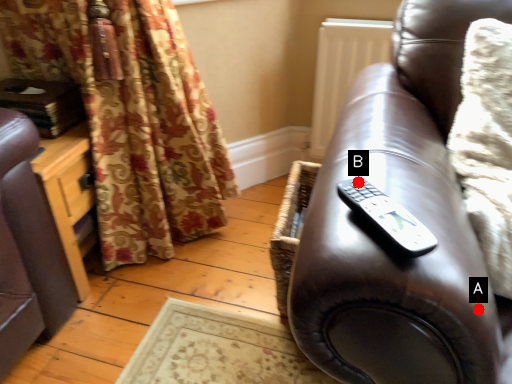
Question: Two points are circled on the image, labeled by A and B beside each circle. Among these points, which one is farthest from the camera?

Choices:
 (A) A is further
 (B) B is further

Answer: (B)